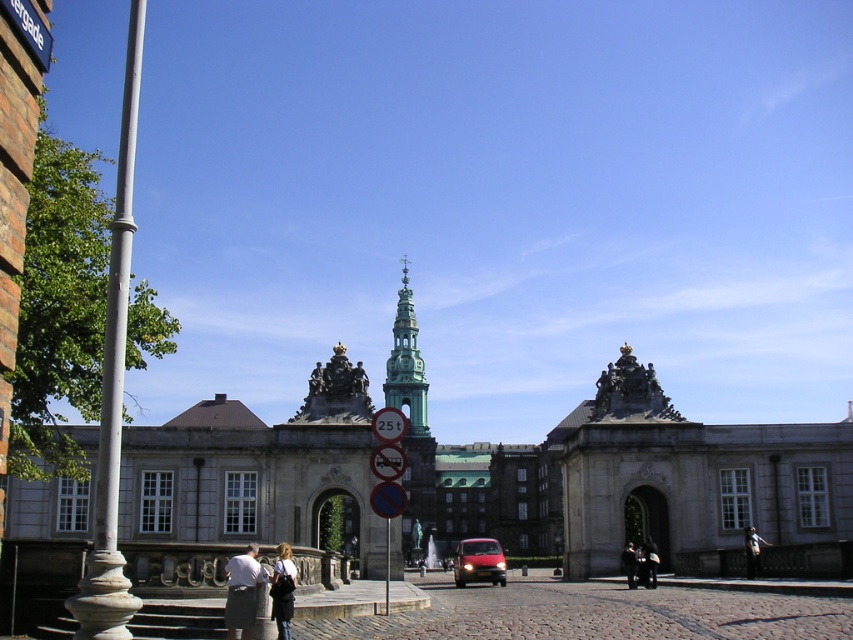
From the picture: What is located at the coordinates point (x=640, y=563) in the image?

The point (x=640, y=563) corresponds to the dark gray fabric couple at center.

You are planning to take a photo of the dark gray fabric couple at center in front of the grand historic building. Which direction should you position yourself relative to the couple to ensure the building is fully visible in the background?

To ensure the grand historic building is fully visible in the background when photographing the dark gray fabric couple at center, position yourself facing the tower with the green roof and weather vane, as the building is the central backdrop behind them.

You are a delivery driver who needs to park your truck, which weighs exactly 25 tons, near the historic building. You see the metallic reflective parking sign at center and the dark brown leather jacket at lower right. Can you park your truck next to the parking sign without violating the weight limit?

The traffic sign indicates a 25t weight limit, so parking a truck that weighs exactly 25 tons is allowed. The metallic reflective parking sign at center is taller than the dark brown leather jacket at lower right, but this does not affect the weight capacity. Therefore, you can park your truck next to the parking sign without violating the weight limit.